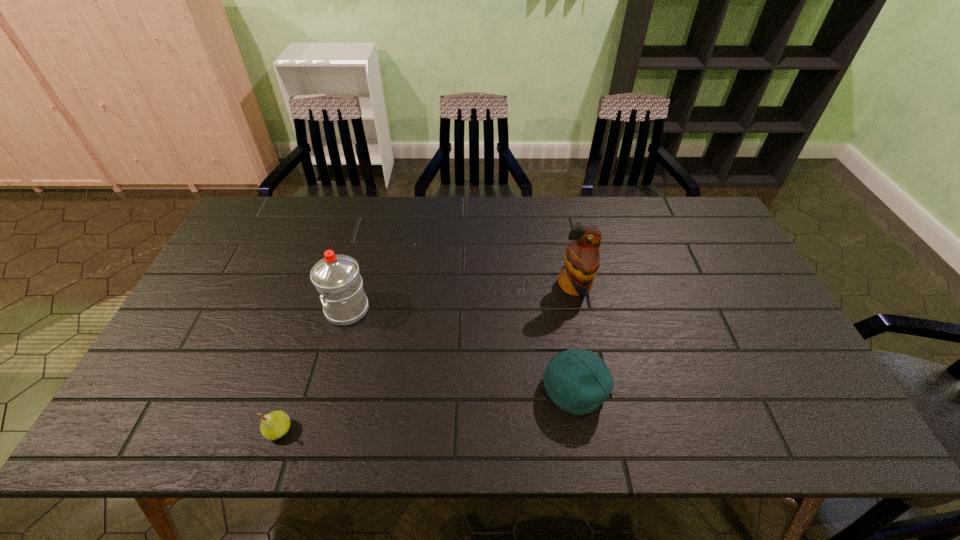
Identify the location of parrot. Image resolution: width=960 pixels, height=540 pixels. pos(582,259).

In order to click on water bottle in this screenshot , I will do `click(336, 277)`.

Image resolution: width=960 pixels, height=540 pixels. In order to click on beanie in this screenshot , I will do `click(578, 381)`.

The image size is (960, 540). I want to click on the shortest object, so click(276, 424).

Identify the location of vacant space located 0.200m on the face of the parrot. The width and height of the screenshot is (960, 540). (590, 361).

You are a GUI agent. You are given a task and a screenshot of the screen. Output one action in this format:
    pyautogui.click(x=<x>, y=<y>)
    Task: Click on the vacant area located 0.250m on the handle side of the water bottle
    The width and height of the screenshot is (960, 540).
    Given the screenshot: What is the action you would take?
    pyautogui.click(x=235, y=309)

What are the coordinates of `vacant space located on the handle side of the water bottle` in the screenshot? It's located at (260, 309).

Where is `free space located on the handle side of the water bottle`? free space located on the handle side of the water bottle is located at coordinates (300, 309).

Locate an element on the screen. This screenshot has width=960, height=540. free space located on the left of the beanie is located at coordinates (475, 389).

Locate an element on the screen. free region located on the back of the shortest object is located at coordinates (320, 306).